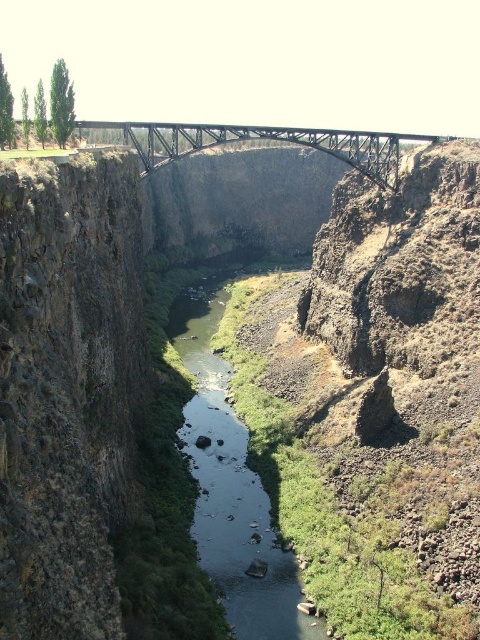
Is green smooth water at center to the left of metallic steel bridge at center from the viewer's perspective?

In fact, green smooth water at center is to the right of metallic steel bridge at center.

Does green smooth water at center have a greater height compared to metallic steel bridge at center?

No, green smooth water at center is not taller than metallic steel bridge at center.

Identify the location of green smooth water at center. (231, 486).